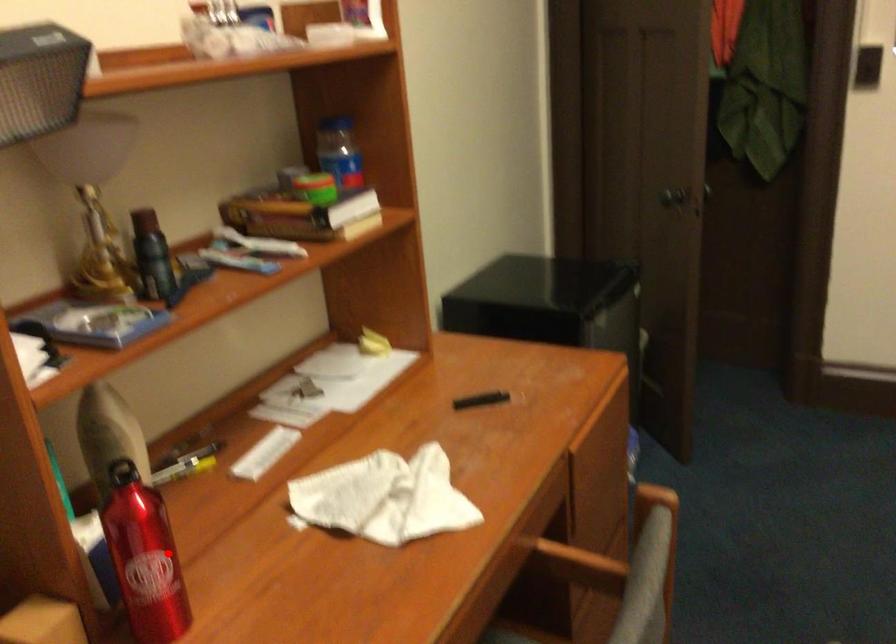
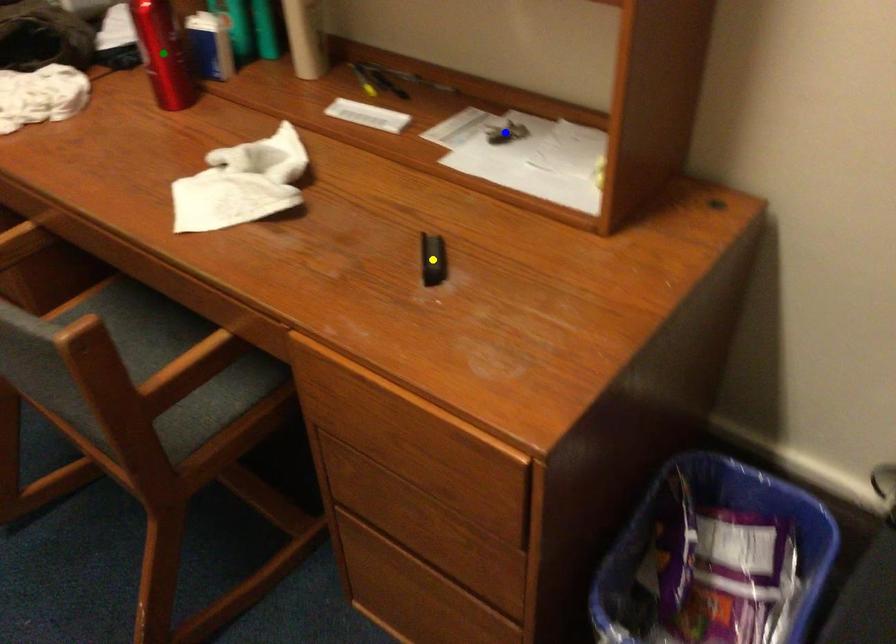
Question: I am providing you with two images of the same scene from different viewpoints. A red point is marked on the first image. You are given multiple points on the second image. Which point in image 2 represents the same 3d spot as the red point in image 1?

Choices:
 (A) yellow point
 (B) green point
 (C) blue point

Answer: (B)